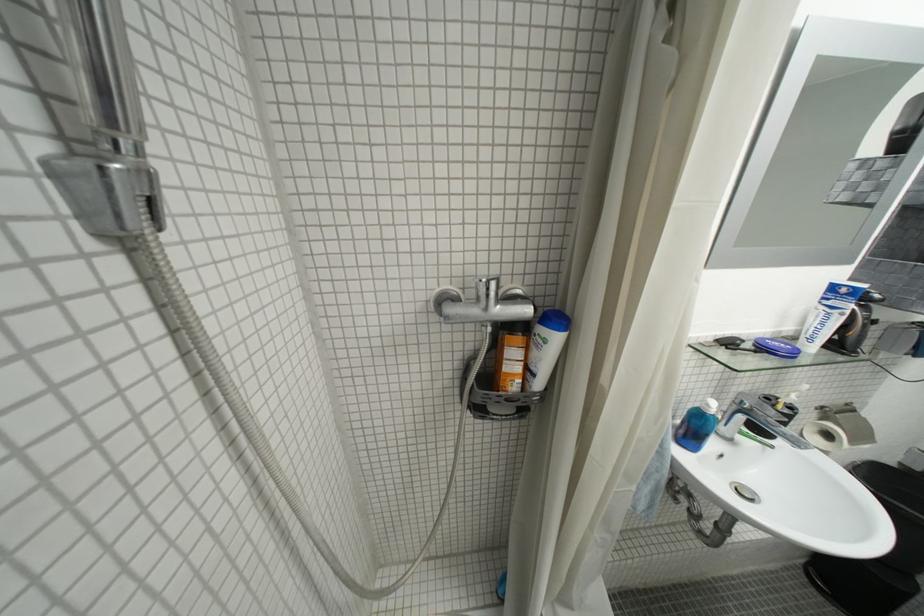
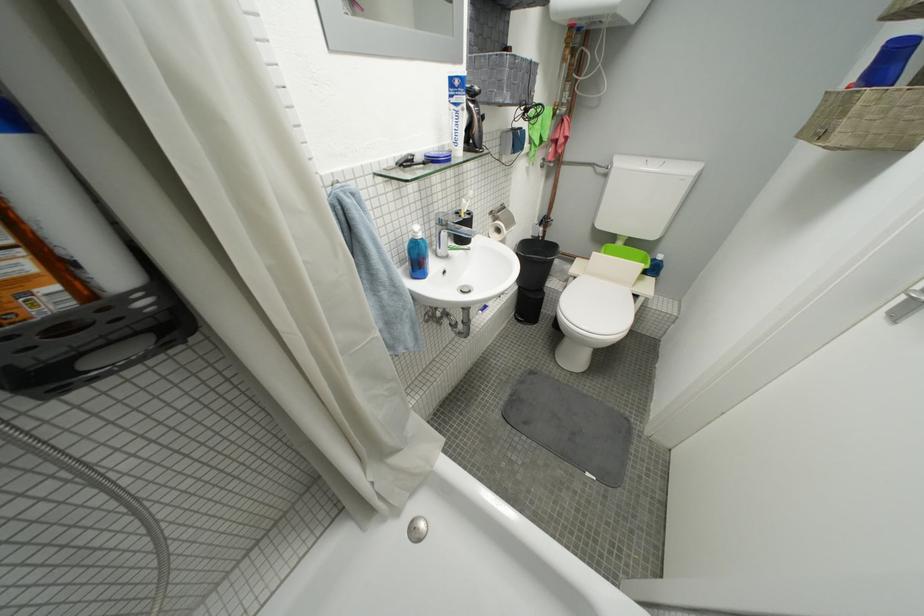
In the second image, find the point that corresponds to (744,408) in the first image.

(447, 230)